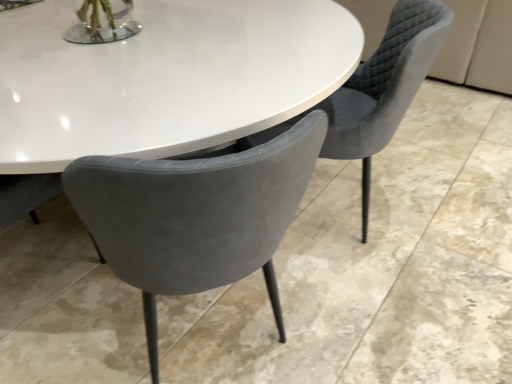
Question: Considering their positions, is matte gray chair at center, the 1th chair from the left, located in front of or behind velvet grey chair at center, which ranks as the first chair in right-to-left order?

Choices:
 (A) behind
 (B) front

Answer: (B)

Question: Considering the positions of matte gray chair at center, the 1th chair from the left, and velvet grey chair at center, which ranks as the first chair in right-to-left order, in the image, is matte gray chair at center, the 1th chair from the left, bigger or smaller than velvet grey chair at center, which ranks as the first chair in right-to-left order,?

Choices:
 (A) small
 (B) big

Answer: (A)

Question: From a real-world perspective, is matte gray chair at center, which is the second chair from right to left, positioned above or below velvet grey chair at center, arranged as the 2th chair when viewed from the left?

Choices:
 (A) below
 (B) above

Answer: (B)

Question: In terms of size, does velvet grey chair at center, which ranks as the first chair in right-to-left order, appear bigger or smaller than matte gray chair at center, the 1th chair from the left?

Choices:
 (A) small
 (B) big

Answer: (B)

Question: In terms of width, does velvet grey chair at center, which ranks as the first chair in right-to-left order, look wider or thinner when compared to matte gray chair at center, which is the second chair from right to left?

Choices:
 (A) wide
 (B) thin

Answer: (A)

Question: Relative to matte gray chair at center, which is the second chair from right to left, is velvet grey chair at center, which ranks as the first chair in right-to-left order, in front or behind?

Choices:
 (A) behind
 (B) front

Answer: (A)

Question: From a real-world perspective, is velvet grey chair at center, arranged as the 2th chair when viewed from the left, above or below matte gray chair at center, which is the second chair from right to left?

Choices:
 (A) below
 (B) above

Answer: (A)